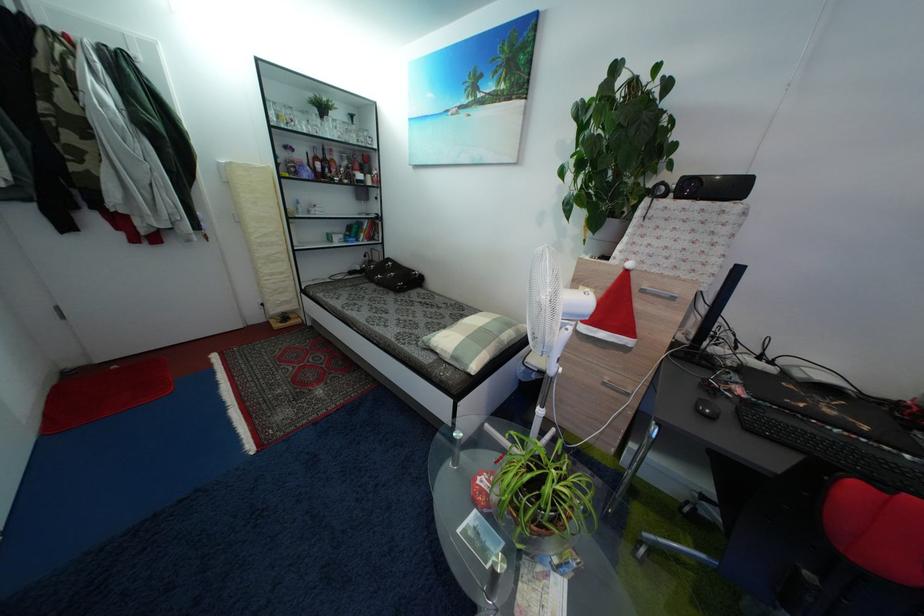
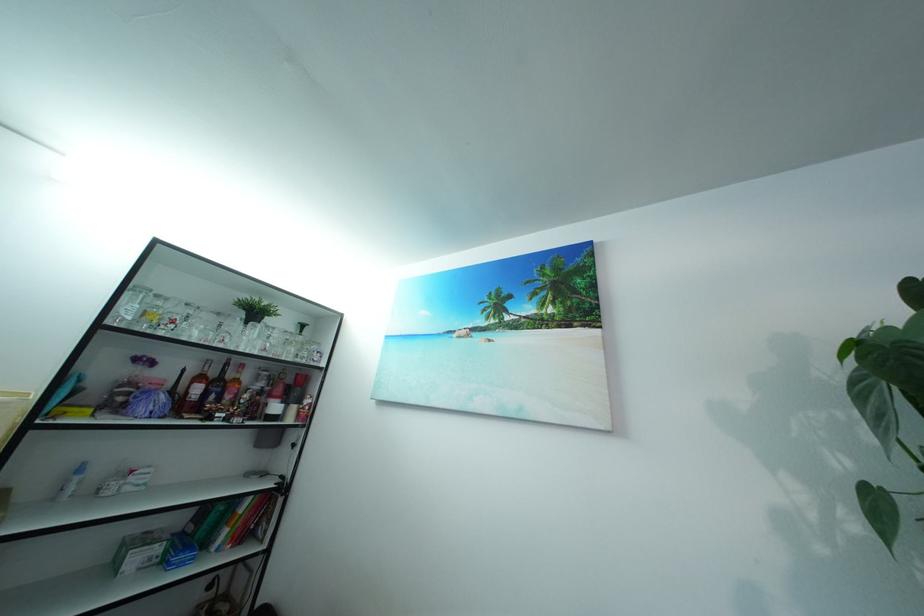
Find the pixel in the second image that matches (329,163) in the first image.

(222, 381)